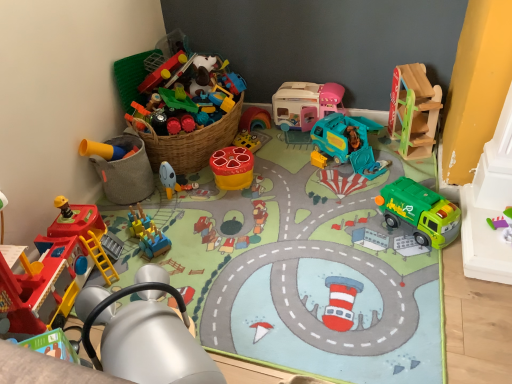
Locate an element on the screen. Image resolution: width=512 pixels, height=384 pixels. vacant space behind matte plastic toy at center, the 7th toy viewed from the right is located at coordinates (192, 176).